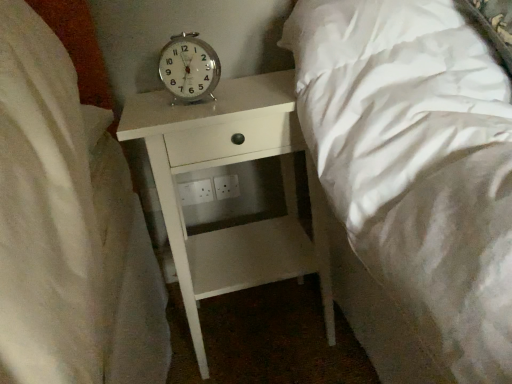
The width and height of the screenshot is (512, 384). Find the location of `vacant space to the right of metallic silver alarm clock at center`. vacant space to the right of metallic silver alarm clock at center is located at coordinates (250, 83).